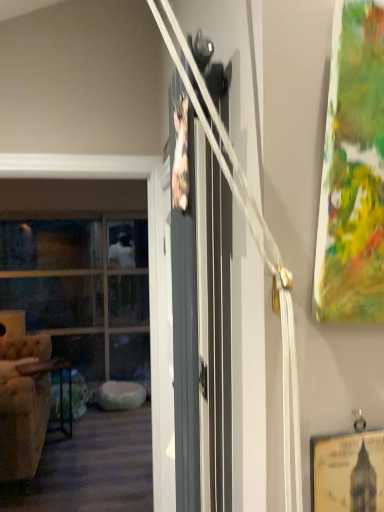
The height and width of the screenshot is (512, 384). Describe the element at coordinates (60, 389) in the screenshot. I see `metallic dark brown table at left` at that location.

I want to click on clear glass window at left, so click(x=82, y=290).

Between point (373, 485) and point (17, 302), which one is positioned behind?

Positioned behind is point (17, 302).

Can you confirm if yellow paper picture frame at lower right is shorter than clear glass window at left?

Yes.

Does yellow paper picture frame at lower right come behind clear glass window at left?

That is False.

Locate an element on the screen. The image size is (384, 512). window on the left of yellow paper picture frame at lower right is located at coordinates (82, 290).

From the image's perspective, is beige tufted armchair at left above metallic dark brown table at left?

Indeed, from the image's perspective, beige tufted armchair at left is shown above metallic dark brown table at left.

Which of these two, beige tufted armchair at left or metallic dark brown table at left, stands shorter?

With less height is metallic dark brown table at left.

Which object is further away from the camera taking this photo, beige tufted armchair at left or metallic dark brown table at left?

metallic dark brown table at left is more distant.

Does beige tufted armchair at left turn towards metallic dark brown table at left?

Yes, beige tufted armchair at left faces towards metallic dark brown table at left.

In terms of height, does yellow paper picture frame at lower right look taller or shorter compared to metallic dark brown table at left?

Considering their sizes, yellow paper picture frame at lower right has less height than metallic dark brown table at left.

Is yellow paper picture frame at lower right not close to metallic dark brown table at left?

Indeed, yellow paper picture frame at lower right is not near metallic dark brown table at left.

The height and width of the screenshot is (512, 384). I want to click on picture frame above the metallic dark brown table at left (from a real-world perspective), so click(347, 472).

Does yellow paper picture frame at lower right turn towards metallic dark brown table at left?

No, yellow paper picture frame at lower right is not facing towards metallic dark brown table at left.

Looking at this image, is metallic dark brown table at left next to clear glass window at left and touching it?

No, metallic dark brown table at left is not making contact with clear glass window at left.

Is metallic dark brown table at left oriented away from clear glass window at left?

Yes.

Who is smaller, metallic dark brown table at left or clear glass window at left?

metallic dark brown table at left.

Which is behind, point (59, 370) or point (140, 378)?

The point (140, 378) is farther.

Is matte gray barn door at center next to beige tufted armchair at left?

matte gray barn door at center and beige tufted armchair at left are clearly separated.

Find the location of a particular element. armchair directly beneath the matte gray barn door at center (from a real-world perspective) is located at coordinates (23, 405).

Which is in front, matte gray barn door at center or beige tufted armchair at left?

matte gray barn door at center is more forward.

From a real-world perspective, between matte gray barn door at center and beige tufted armchair at left, who is vertically higher?

In real-world perspective, matte gray barn door at center is above.

Considering the points (21, 467) and (178, 442), which point is in front, point (21, 467) or point (178, 442)?

The point (178, 442) is closer to the camera.

Is beige tufted armchair at left next to matte gray barn door at center?

No, beige tufted armchair at left is not in contact with matte gray barn door at center.

Which object is positioned more to the left, beige tufted armchair at left or matte gray barn door at center?

beige tufted armchair at left.

Does beige tufted armchair at left have a greater width compared to matte gray barn door at center?

Indeed, beige tufted armchair at left has a greater width compared to matte gray barn door at center.

Is metallic dark brown table at left not close to yellow paper picture frame at lower right?

Indeed, metallic dark brown table at left is not near yellow paper picture frame at lower right.

From the image's perspective, which one is positioned lower, metallic dark brown table at left or yellow paper picture frame at lower right?

metallic dark brown table at left.

Does metallic dark brown table at left turn towards yellow paper picture frame at lower right?

Yes, metallic dark brown table at left is aimed at yellow paper picture frame at lower right.

From a real-world perspective, is metallic dark brown table at left positioned above or below yellow paper picture frame at lower right?

From a real-world perspective, metallic dark brown table at left is physically below yellow paper picture frame at lower right.

I want to click on window behind the yellow paper picture frame at lower right, so click(82, 290).

You are a GUI agent. You are given a task and a screenshot of the screen. Output one action in this format:
    pyautogui.click(x=<x>, y=<y>)
    Task: Click on the table to the right of beige tufted armchair at left
    This screenshot has height=512, width=384.
    Given the screenshot: What is the action you would take?
    pyautogui.click(x=60, y=389)

Which object lies further to the anchor point metallic dark brown table at left, yellow paper picture frame at lower right or clear glass window at left?

yellow paper picture frame at lower right is further to metallic dark brown table at left.

Which object lies nearer to the anchor point yellow paper picture frame at lower right, beige tufted armchair at left or matte gray barn door at center?

Based on the image, matte gray barn door at center appears to be nearer to yellow paper picture frame at lower right.

Estimate the real-world distances between objects in this image. Which object is further from metallic dark brown table at left, beige tufted armchair at left or clear glass window at left?

Among the two, clear glass window at left is located further to metallic dark brown table at left.

Consider the image. From the image, which object appears to be farther from yellow paper picture frame at lower right, clear glass window at left or metallic dark brown table at left?

The object further to yellow paper picture frame at lower right is clear glass window at left.

Looking at the image, which one is located further to matte gray barn door at center, yellow paper picture frame at lower right or clear glass window at left?

clear glass window at left is positioned further to the anchor matte gray barn door at center.

When comparing their distances from clear glass window at left, does metallic dark brown table at left or matte gray barn door at center seem closer?

Among the two, metallic dark brown table at left is located nearer to clear glass window at left.

Looking at the image, which one is located closer to yellow paper picture frame at lower right, beige tufted armchair at left or metallic dark brown table at left?

Among the two, beige tufted armchair at left is located nearer to yellow paper picture frame at lower right.

Based on their spatial positions, is clear glass window at left or metallic dark brown table at left closer to matte gray barn door at center?

Based on the image, metallic dark brown table at left appears to be nearer to matte gray barn door at center.

Find the location of `armchair between matte gray barn door at center and clear glass window at left along the z-axis`. armchair between matte gray barn door at center and clear glass window at left along the z-axis is located at coordinates (23, 405).

You are a GUI agent. You are given a task and a screenshot of the screen. Output one action in this format:
    pyautogui.click(x=<x>, y=<y>)
    Task: Click on the armchair positioned between yellow paper picture frame at lower right and metallic dark brown table at left from near to far
    This screenshot has width=384, height=512.
    Given the screenshot: What is the action you would take?
    pyautogui.click(x=23, y=405)

At what (x,y) coordinates should I click in order to perform the action: click on table positioned between yellow paper picture frame at lower right and clear glass window at left from near to far. Please return your answer as a coordinate pair (x, y). This screenshot has width=384, height=512. Looking at the image, I should click on coord(60,389).

The width and height of the screenshot is (384, 512). Identify the location of armchair between matte gray barn door at center and metallic dark brown table at left along the z-axis. (23, 405).